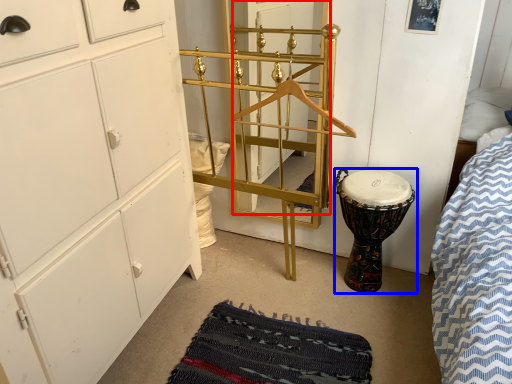
Question: Among these objects, which one is farthest to the camera, door (highlighted by a red box) or drum (highlighted by a blue box)?

Choices:
 (A) door
 (B) drum

Answer: (A)